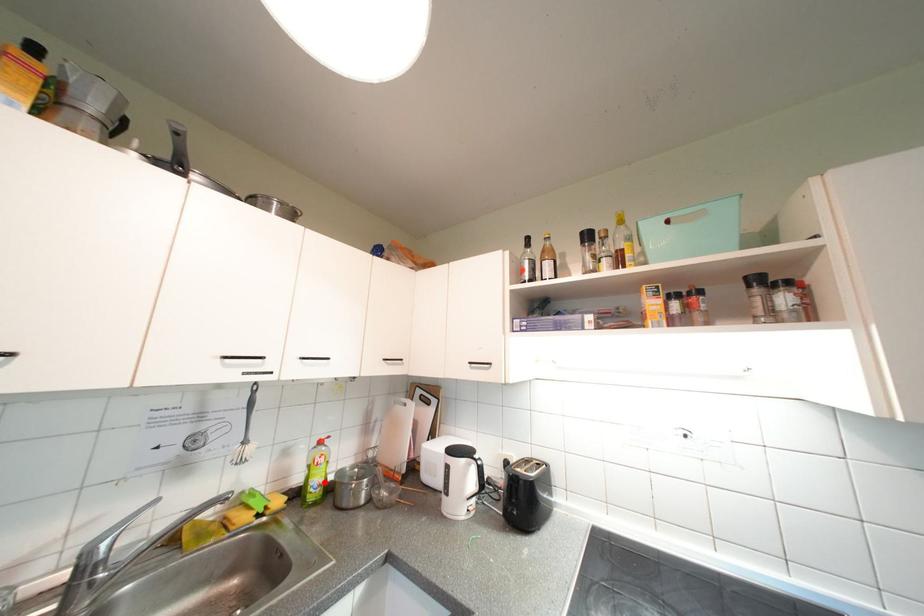
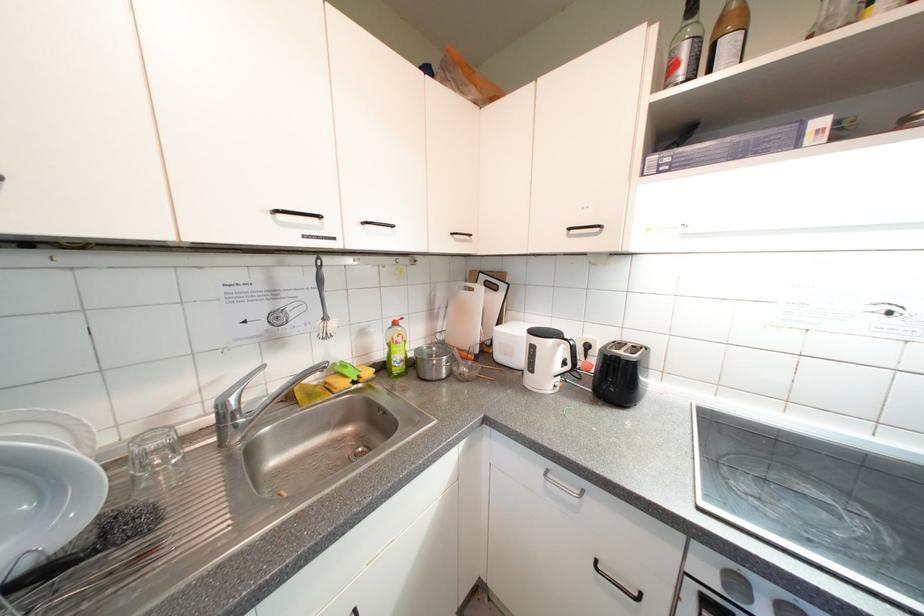
Locate, in the second image, the point that corresponds to the highlighted location in the first image.

(406, 358)